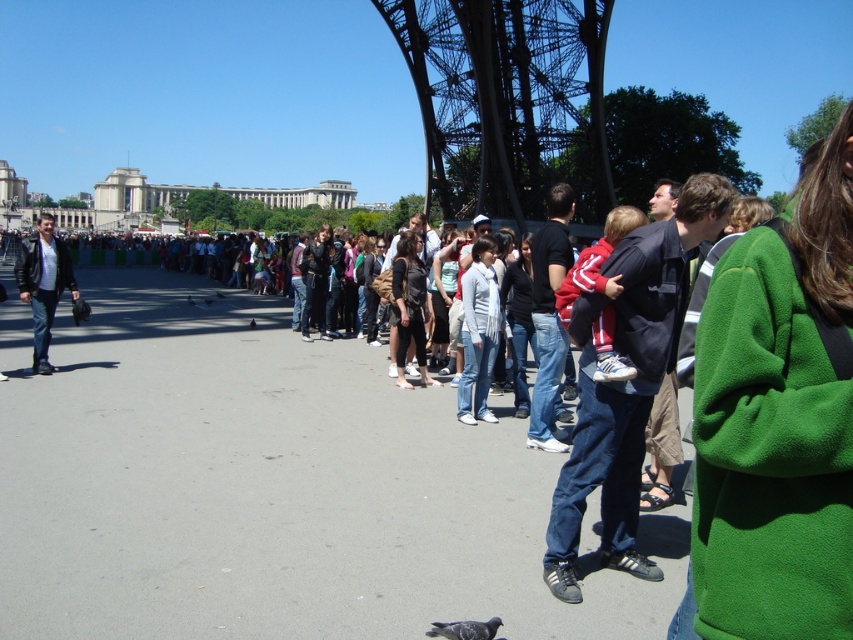
Question: Can you confirm if green fleece jacket at center is wider than metallic structure at center?

Choices:
 (A) yes
 (B) no

Answer: (B)

Question: Which point appears closest to the camera in this image?

Choices:
 (A) (38, 342)
 (B) (773, 456)

Answer: (B)

Question: Does green fleece jacket at center have a lesser width compared to metallic structure at center?

Choices:
 (A) yes
 (B) no

Answer: (A)

Question: Is black leather jacket at left further to camera compared to gray matte pigeon at lower center?

Choices:
 (A) no
 (B) yes

Answer: (B)

Question: Which of the following is the closest to the observer?

Choices:
 (A) metallic structure at center
 (B) black leather jacket at left

Answer: (A)

Question: Which of these objects is positioned closest to the green fleece jacket at center?

Choices:
 (A) black leather jacket at left
 (B) metallic structure at center
 (C) gray matte pigeon at lower center

Answer: (C)